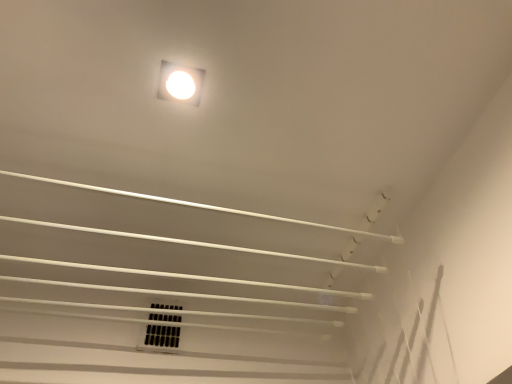
Question: Are black plastic vent at center and white glossy light fixture at upper center located far from each other?

Choices:
 (A) yes
 (B) no

Answer: (B)

Question: Is black plastic vent at center touching white glossy light fixture at upper center?

Choices:
 (A) no
 (B) yes

Answer: (A)

Question: Is black plastic vent at center not inside white glossy light fixture at upper center?

Choices:
 (A) yes
 (B) no

Answer: (A)

Question: Is black plastic vent at center wider than white glossy light fixture at upper center?

Choices:
 (A) no
 (B) yes

Answer: (A)

Question: From a real-world perspective, is black plastic vent at center over white glossy light fixture at upper center?

Choices:
 (A) no
 (B) yes

Answer: (A)

Question: Does black plastic vent at center lie behind white glossy light fixture at upper center?

Choices:
 (A) no
 (B) yes

Answer: (B)

Question: Is white glossy light fixture at upper center far away from black plastic vent at center?

Choices:
 (A) yes
 (B) no

Answer: (B)

Question: Can you confirm if white glossy light fixture at upper center is bigger than black plastic vent at center?

Choices:
 (A) no
 (B) yes

Answer: (A)

Question: From a real-world perspective, is white glossy light fixture at upper center on black plastic vent at center?

Choices:
 (A) no
 (B) yes

Answer: (B)

Question: Would you say black plastic vent at center is part of white glossy light fixture at upper center's contents?

Choices:
 (A) no
 (B) yes

Answer: (A)

Question: Could you tell me if white glossy light fixture at upper center is facing black plastic vent at center?

Choices:
 (A) yes
 (B) no

Answer: (B)

Question: Can you confirm if white glossy light fixture at upper center is shorter than black plastic vent at center?

Choices:
 (A) no
 (B) yes

Answer: (B)

Question: Is black plastic vent at center to the left or to the right of white glossy light fixture at upper center in the image?

Choices:
 (A) left
 (B) right

Answer: (A)